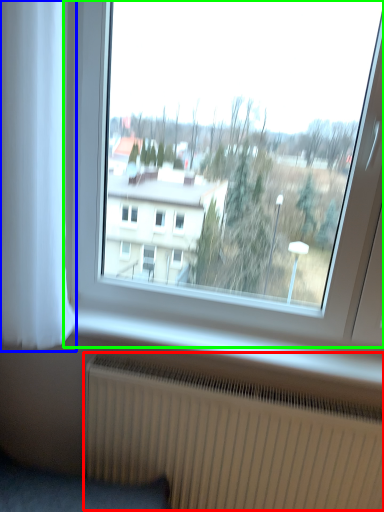
Question: Which object is positioned closest to radiator (highlighted by a red box)? Select from curtain (highlighted by a blue box) and window (highlighted by a green box).

Choices:
 (A) curtain
 (B) window

Answer: (A)